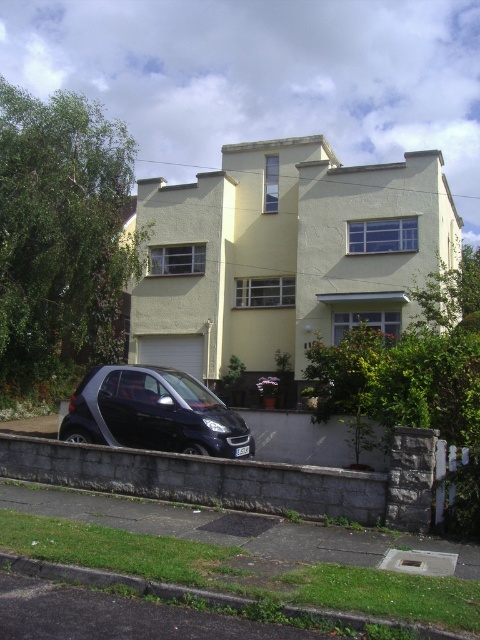
Is point (250, 456) farther from camera compared to point (69, 579)?

Yes, it is.

Which is below, shiny black car at lower left or green grass at lower left?

green grass at lower left is lower down.

Identify the location of shiny black car at lower left. (154, 413).

You are a GUI agent. You are given a task and a screenshot of the screen. Output one action in this format:
    pyautogui.click(x=<x>, y=<y>)
    Task: Click on the shiny black car at lower left
    This screenshot has height=640, width=480.
    Given the screenshot: What is the action you would take?
    pyautogui.click(x=154, y=413)

Does point (66, 449) come closer to viewer compared to point (87, 385)?

That is True.

Between gray concrete curb at lower center and shiny black car at lower left, which one has less height?

gray concrete curb at lower center

Image resolution: width=480 pixels, height=640 pixels. What do you see at coordinates (199, 477) in the screenshot?
I see `gray concrete curb at lower center` at bounding box center [199, 477].

Identify the location of gray concrete curb at lower center. (199, 477).

Does gray concrete curb at lower center have a lesser height compared to green grass at lower left?

Incorrect, gray concrete curb at lower center's height does not fall short of green grass at lower left's.

Who is taller, gray concrete curb at lower center or green grass at lower left?

With more height is gray concrete curb at lower center.

Find the location of a particular element. The image size is (480, 640). gray concrete curb at lower center is located at coordinates (199, 477).